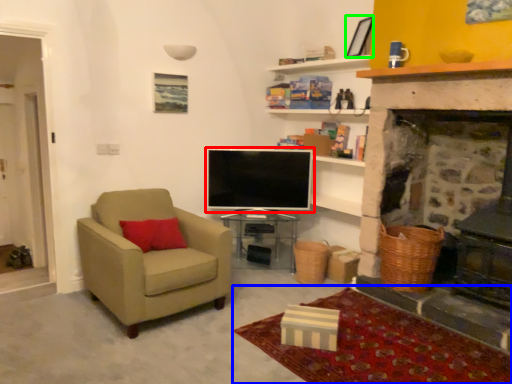
Question: Estimate the real-world distances between objects in this image. Which object is closer to television (highlighted by a red box), plain (highlighted by a blue box) or picture frame (highlighted by a green box)?

Choices:
 (A) plain
 (B) picture frame

Answer: (B)